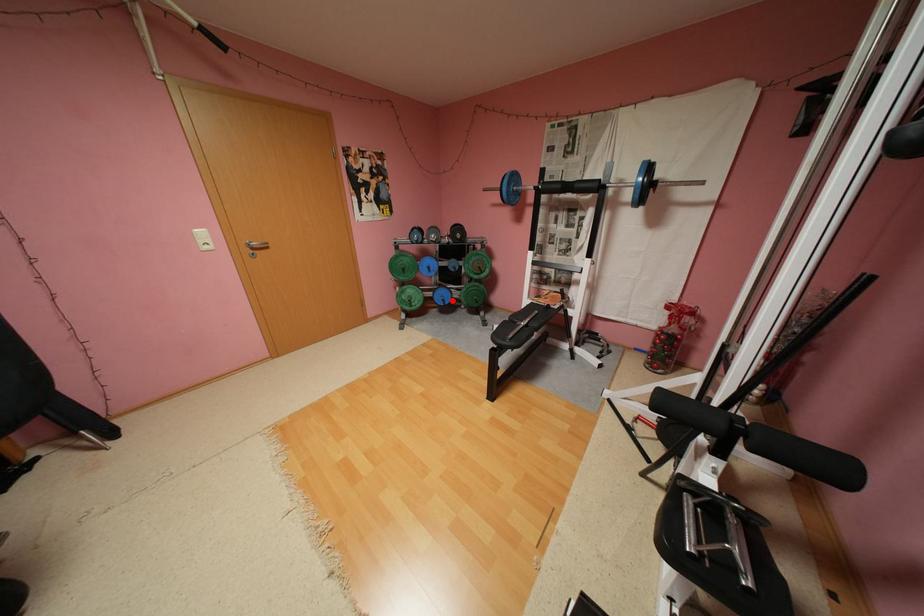
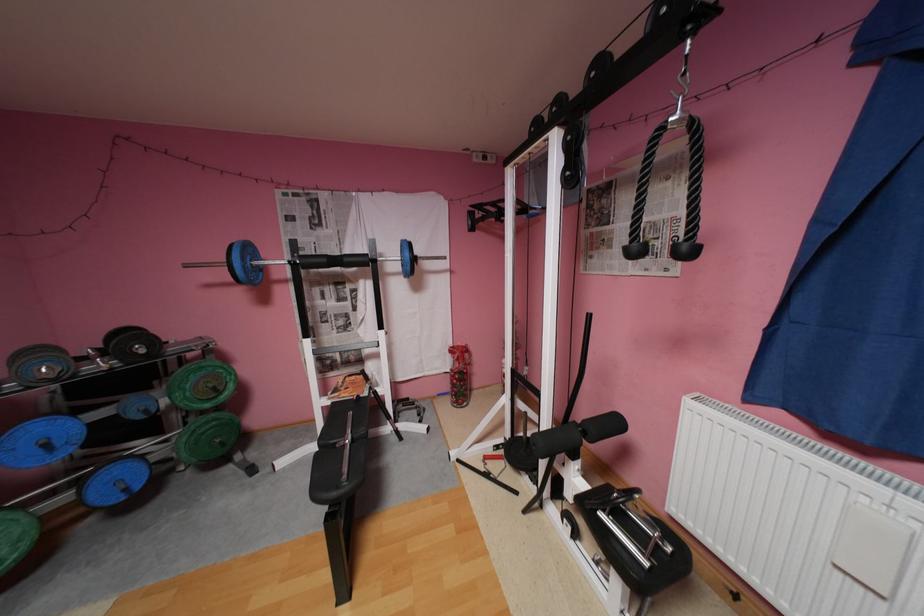
Question: I am providing you with two images of the same scene from different viewpoints. In image1, a red point is highlighted. Considering the same 3D point in image2, which of the following is correct?

Choices:
 (A) It is closer
 (B) It is farther

Answer: (A)